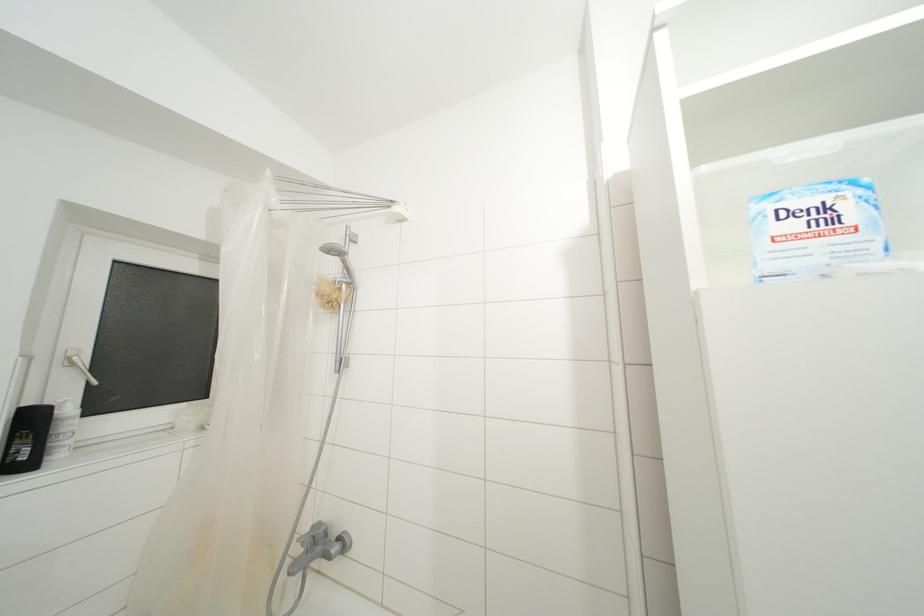
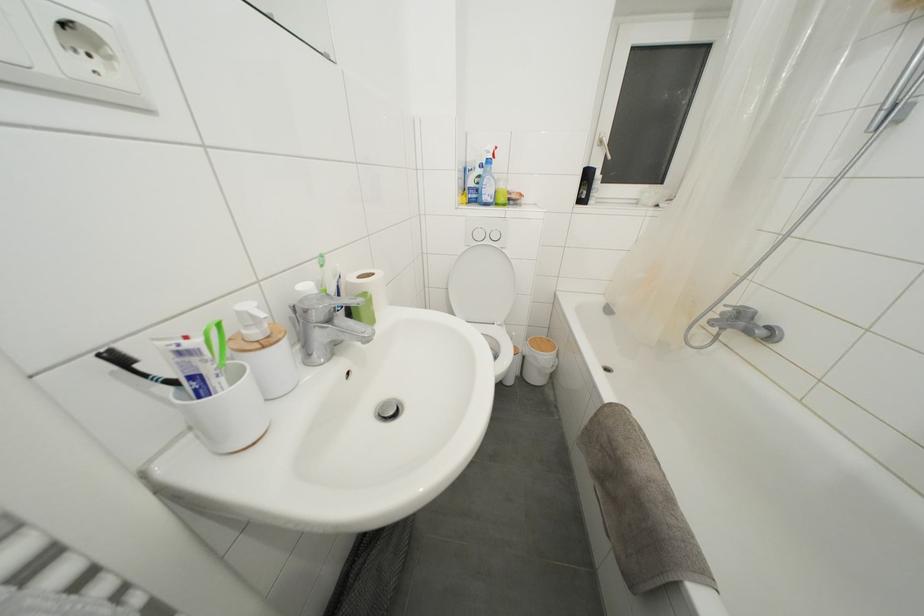
Consider the image. The images are taken continuously from a first-person perspective. In which direction is your viewpoint rotating?

The camera's rotation is toward left-down.